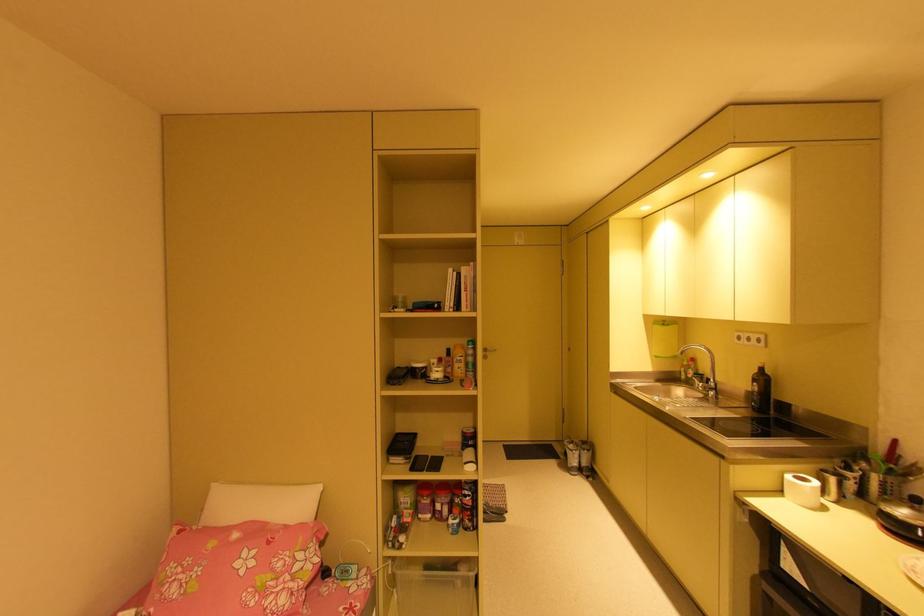
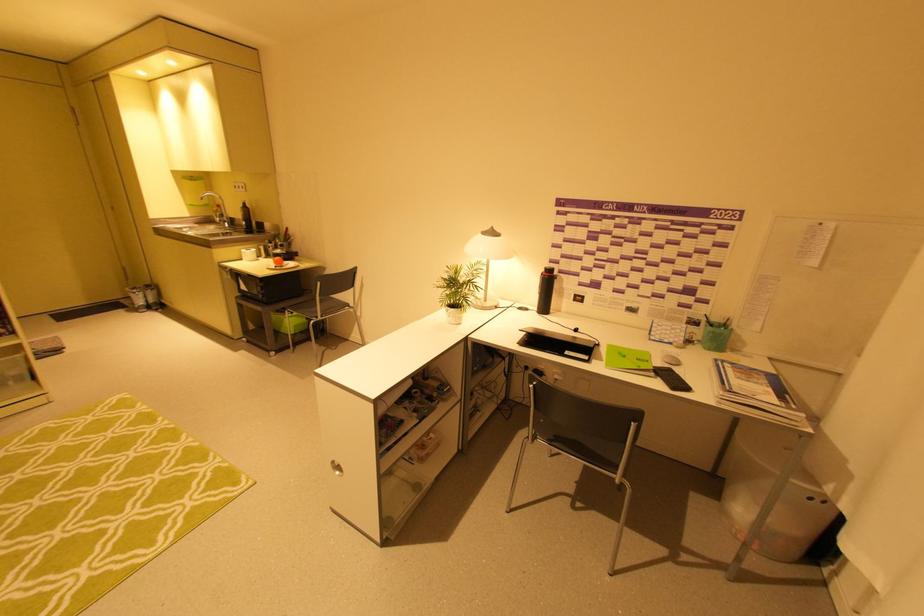
In the second image, find the point that corresponds to point (682, 370) in the first image.

(215, 215)